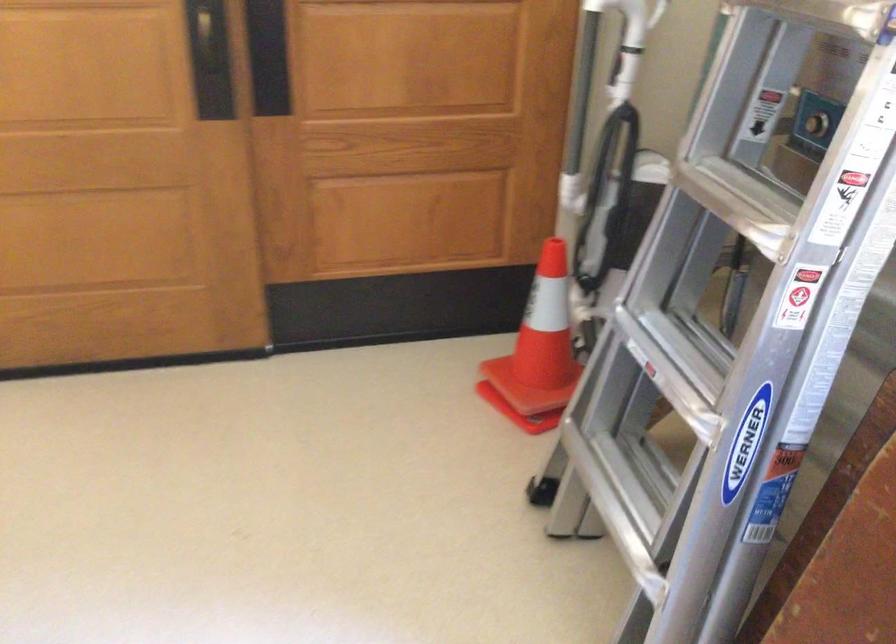
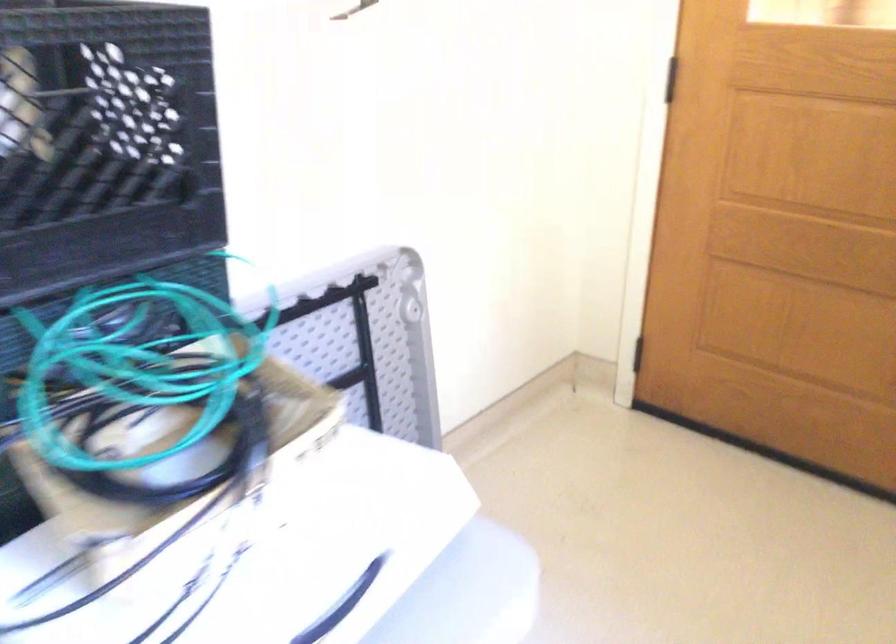
Question: The images are taken continuously from a first-person perspective. In which direction is your viewpoint rotating?

Choices:
 (A) Left
 (B) Right
 (C) Up
 (D) Down

Answer: (A)